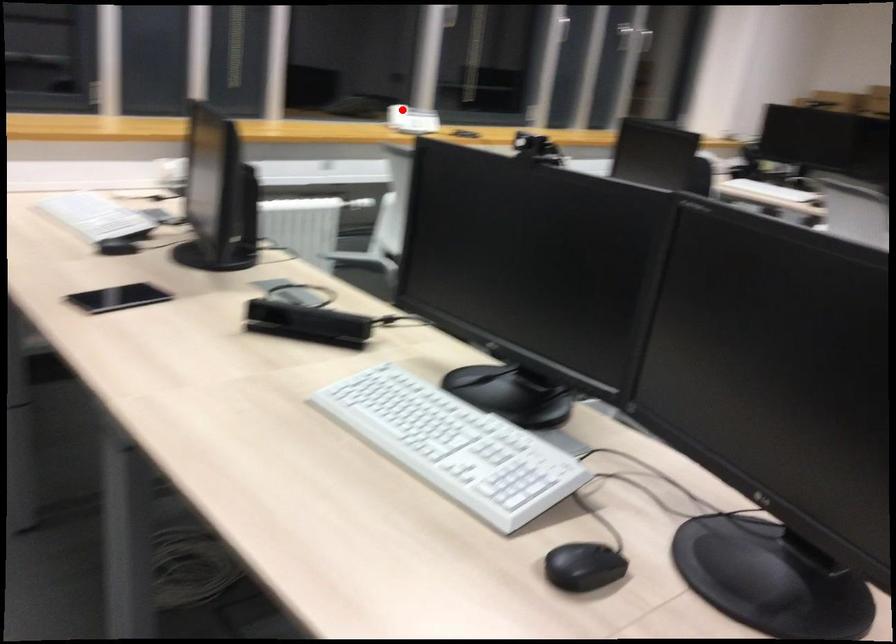
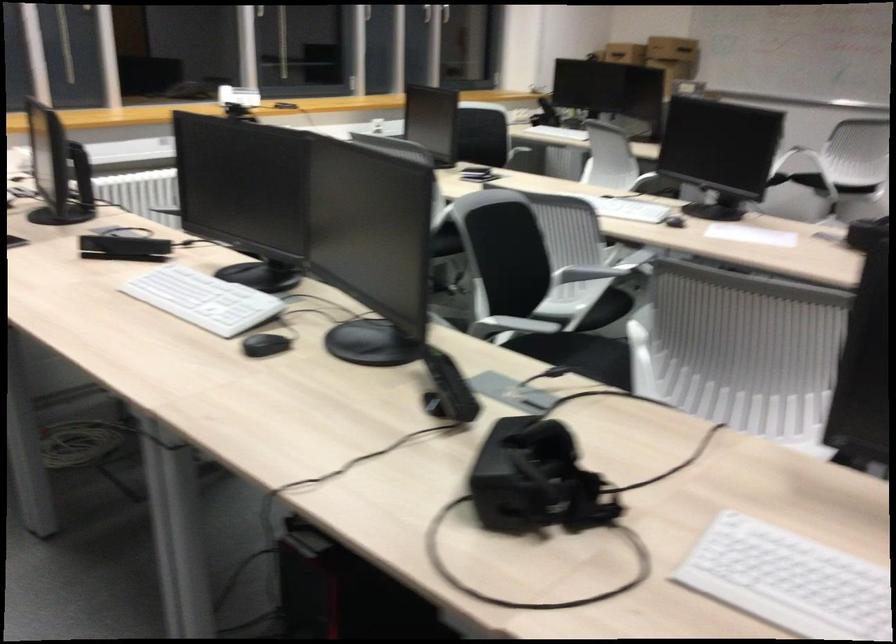
Question: I am providing you with two images of the same scene from different viewpoints. In image1, a red point is highlighted. Considering the same 3D point in image2, which of the following is correct?

Choices:
 (A) It is closer
 (B) It is farther

Answer: (B)